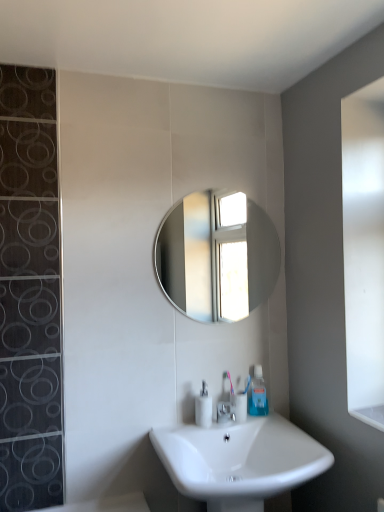
Question: Does white glossy sink at lower center have a greater height compared to clear plastic toothpaste tube at lower center?

Choices:
 (A) yes
 (B) no

Answer: (A)

Question: Is white glossy sink at lower center oriented towards clear plastic toothpaste tube at lower center?

Choices:
 (A) yes
 (B) no

Answer: (B)

Question: From a real-world perspective, is white glossy sink at lower center beneath clear plastic toothpaste tube at lower center?

Choices:
 (A) yes
 (B) no

Answer: (A)

Question: Is white glossy sink at lower center bigger than clear plastic toothpaste tube at lower center?

Choices:
 (A) yes
 (B) no

Answer: (A)

Question: Does white glossy sink at lower center have a lesser width compared to clear plastic toothpaste tube at lower center?

Choices:
 (A) yes
 (B) no

Answer: (B)

Question: Considering the positions of point (264, 409) and point (203, 414), is point (264, 409) closer or farther from the camera than point (203, 414)?

Choices:
 (A) farther
 (B) closer

Answer: (A)

Question: Based on their sizes in the image, would you say clear plastic toothpaste tube at lower center is bigger or smaller than white glossy soap dispenser at center?

Choices:
 (A) small
 (B) big

Answer: (A)

Question: From the image's perspective, is clear plastic toothpaste tube at lower center located above or below white glossy soap dispenser at center?

Choices:
 (A) below
 (B) above

Answer: (B)

Question: Is clear plastic toothpaste tube at lower center taller or shorter than white glossy soap dispenser at center?

Choices:
 (A) tall
 (B) short

Answer: (A)

Question: Looking at the image, does silver metallic faucet at center seem bigger or smaller compared to white glossy soap dispenser at center?

Choices:
 (A) small
 (B) big

Answer: (A)

Question: From the image's perspective, relative to white glossy soap dispenser at center, is silver metallic faucet at center above or below?

Choices:
 (A) below
 (B) above

Answer: (A)

Question: Choose the correct answer: Is silver metallic faucet at center inside white glossy soap dispenser at center or outside it?

Choices:
 (A) outside
 (B) inside

Answer: (A)

Question: Does point (231, 417) appear closer or farther from the camera than point (203, 413)?

Choices:
 (A) farther
 (B) closer

Answer: (A)

Question: Does point (248, 406) appear closer or farther from the camera than point (178, 280)?

Choices:
 (A) farther
 (B) closer

Answer: (B)

Question: Visually, is clear plastic toothpaste tube at lower center positioned to the left or to the right of shiny silver mirror at center?

Choices:
 (A) right
 (B) left

Answer: (A)